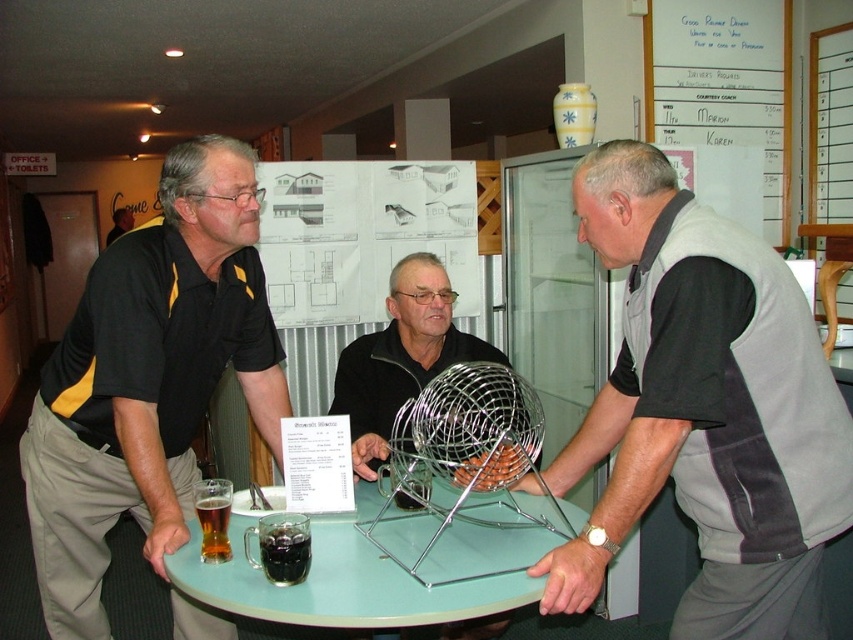
Can you confirm if gray fabric vest at center is shorter than translucent glass table at center?

No.

Is gray fabric vest at center to the right of translucent glass table at center from the viewer's perspective?

Indeed, gray fabric vest at center is positioned on the right side of translucent glass table at center.

Is point (676, 218) closer to camera compared to point (323, 563)?

Yes, point (676, 218) is closer to viewer.

This screenshot has width=853, height=640. Identify the location of gray fabric vest at center. (705, 410).

Does gray fabric vest at center have a greater width compared to metallic wire ball at center?

Yes.

Does gray fabric vest at center have a smaller size compared to metallic wire ball at center?

Incorrect, gray fabric vest at center is not smaller in size than metallic wire ball at center.

Image resolution: width=853 pixels, height=640 pixels. Describe the element at coordinates (705, 410) in the screenshot. I see `gray fabric vest at center` at that location.

You are a GUI agent. You are given a task and a screenshot of the screen. Output one action in this format:
    pyautogui.click(x=<x>, y=<y>)
    Task: Click on the gray fabric vest at center
    
    Given the screenshot: What is the action you would take?
    pyautogui.click(x=705, y=410)

Who is positioned more to the left, translucent glass table at center or metallic wire ball at center?

translucent glass table at center is more to the left.

Who is shorter, translucent glass table at center or metallic wire ball at center?

translucent glass table at center

Is point (247, 509) farther from viewer compared to point (393, 417)?

That is False.

This screenshot has height=640, width=853. Find the location of `translucent glass table at center`. translucent glass table at center is located at coordinates (332, 582).